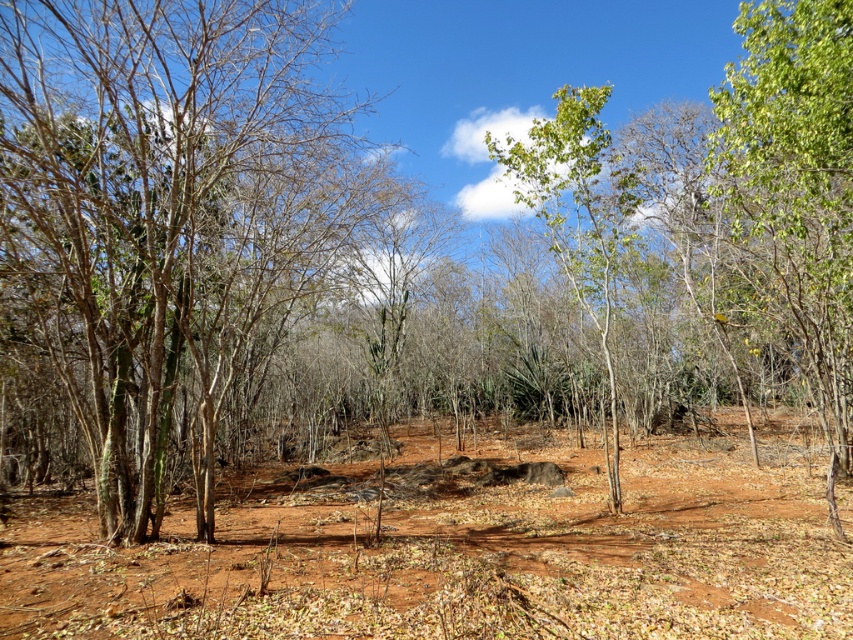
You are standing at the origin point of the coordinate system in this landscape. There is a point marked at coordinate point (x=167, y=214). What object is located at that coordinate point?

The point at coordinate (x=167, y=214) corresponds to the green leafy tree at left.

You are a geologist examining the landscape. You notice a point marked at coordinates (463, 548). Based on the scene description, what is the likely composition of the material at this point?

The point at (463, 548) indicates dull reddish brown soil at center, so the material is likely composed of reddish brown soil.